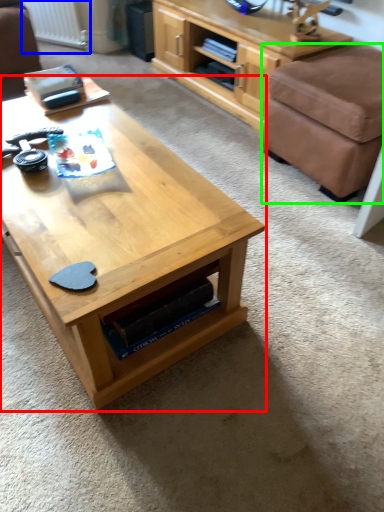
Question: Considering the real-world distances, which object is closest to coffee table (highlighted by a red box)? radiator (highlighted by a blue box) or stool (highlighted by a green box).

Choices:
 (A) radiator
 (B) stool

Answer: (B)